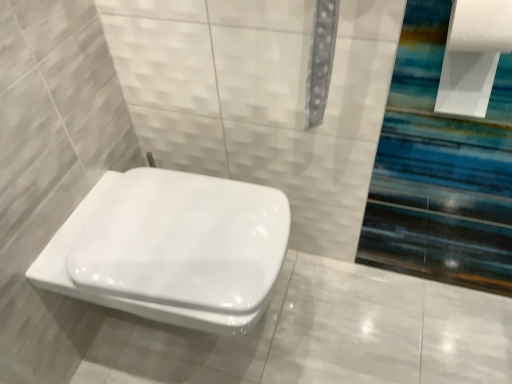
Identify the location of free point below white glossy toilet at center (from a real-world perspective). (216, 343).